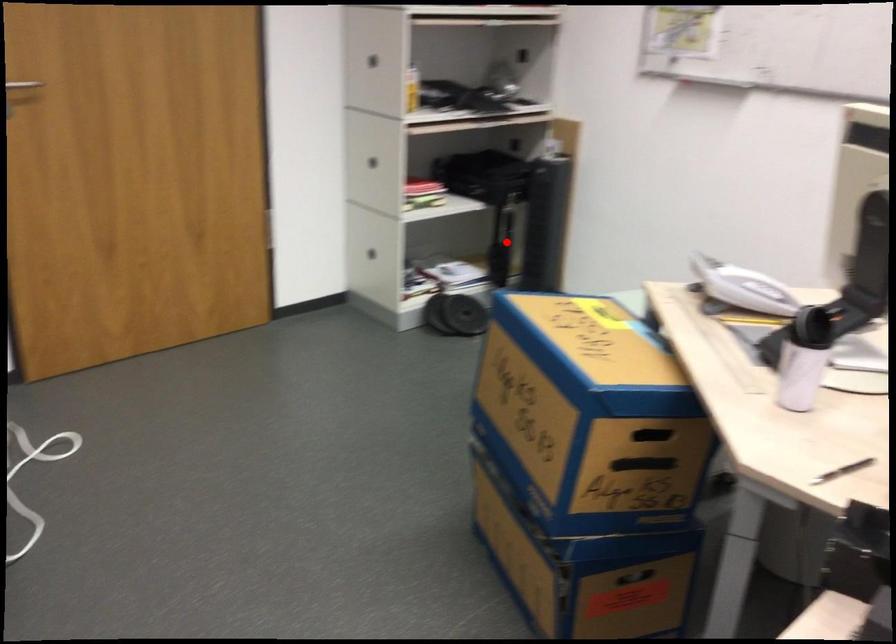
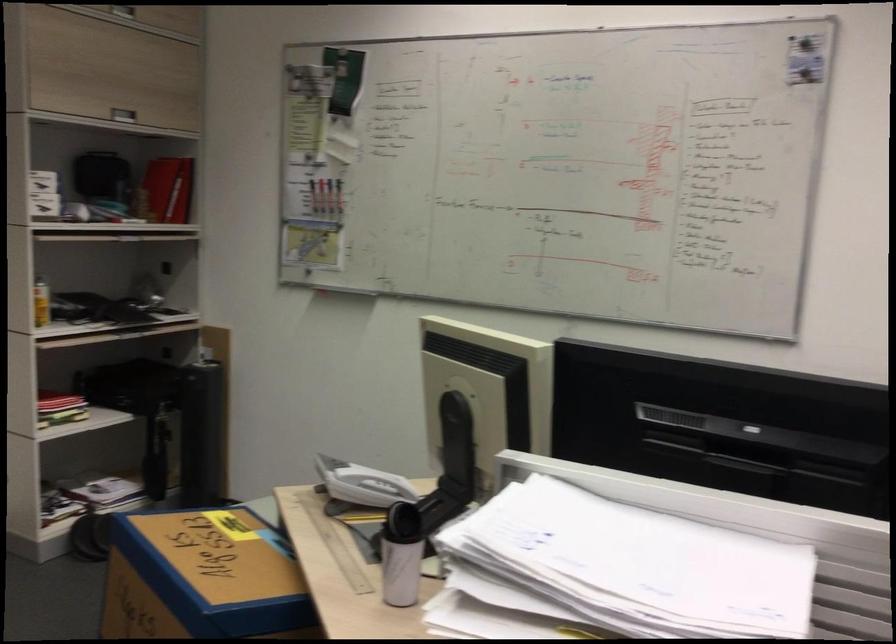
Where in the second image is the point corresponding to the highlighted location from the first image?

(169, 451)